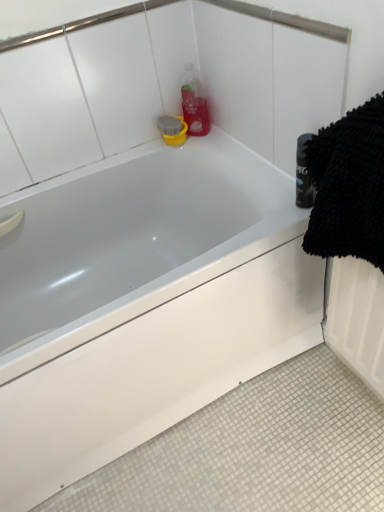
Locate an element on the screen. The width and height of the screenshot is (384, 512). vacant space underneath black microfiber towel at right (from a real-world perspective) is located at coordinates (349, 393).